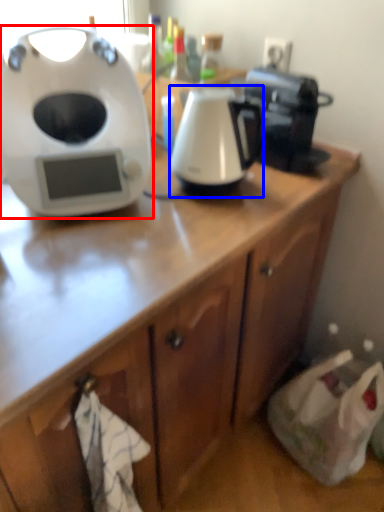
Question: Among these objects, which one is nearest to the camera, home appliance (highlighted by a red box) or kitchen appliance (highlighted by a blue box)?

Choices:
 (A) home appliance
 (B) kitchen appliance

Answer: (A)